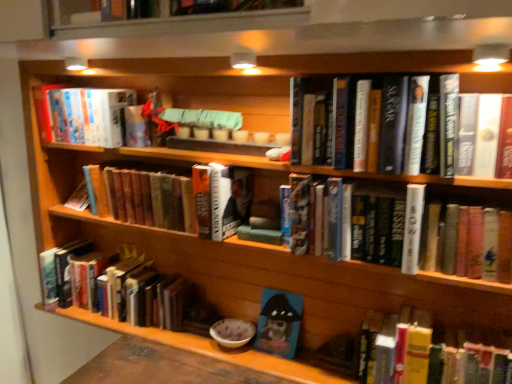
Question: Which direction should I rotate to look at hardcover book at center, positioned as the 3th book in top-to-bottom order, — up or down?

Choices:
 (A) down
 (B) up

Answer: (B)

Question: Is hardcover book at center, positioned as the 3th book in top-to-bottom order, taller than hardcover book at lower left, the 2th book positioned from the bottom?

Choices:
 (A) no
 (B) yes

Answer: (A)

Question: Considering the relative positions of hardcover book at center, positioned as the 3th book in top-to-bottom order, and hardcover book at lower left, the 5th book positioned from the top, in the image provided, is hardcover book at center, positioned as the 3th book in top-to-bottom order, in front of hardcover book at lower left, the 5th book positioned from the top,?

Choices:
 (A) no
 (B) yes

Answer: (B)

Question: Is hardcover book at center, positioned as the 3th book in top-to-bottom order, far away from hardcover book at lower left, the 5th book positioned from the top?

Choices:
 (A) yes
 (B) no

Answer: (B)

Question: From a real-world perspective, is hardcover book at center, positioned as the 3th book in top-to-bottom order, over hardcover book at lower left, the 2th book positioned from the bottom?

Choices:
 (A) no
 (B) yes

Answer: (B)

Question: Does hardcover book at center, positioned as the 3th book in top-to-bottom order, have a lesser height compared to hardcover book at lower left, the 5th book positioned from the top?

Choices:
 (A) yes
 (B) no

Answer: (A)

Question: From a real-world perspective, does hardcover book at center, positioned as the 4th book in bottom-to-top order, sit lower than hardcover book at lower left, the 2th book positioned from the bottom?

Choices:
 (A) yes
 (B) no

Answer: (B)

Question: Considering the relative sizes of hardcover book at center, positioned as the 5th book in bottom-to-top order, and hardcover book at center, positioned as the 3th book in top-to-bottom order, in the image provided, is hardcover book at center, positioned as the 5th book in bottom-to-top order, wider than hardcover book at center, positioned as the 3th book in top-to-bottom order,?

Choices:
 (A) yes
 (B) no

Answer: (B)

Question: Is hardcover book at center, positioned as the 5th book in bottom-to-top order, positioned with its back to hardcover book at center, positioned as the 4th book in bottom-to-top order?

Choices:
 (A) no
 (B) yes

Answer: (A)

Question: Could you tell me if hardcover book at center, positioned as the 5th book in bottom-to-top order, is facing hardcover book at center, positioned as the 3th book in top-to-bottom order?

Choices:
 (A) no
 (B) yes

Answer: (A)

Question: From the image's perspective, is hardcover book at center, positioned as the 5th book in bottom-to-top order, on top of hardcover book at center, positioned as the 3th book in top-to-bottom order?

Choices:
 (A) no
 (B) yes

Answer: (B)

Question: Considering the relative sizes of hardcover book at center, the second book in the top-to-bottom sequence, and hardcover book at center, positioned as the 3th book in top-to-bottom order, in the image provided, is hardcover book at center, the second book in the top-to-bottom sequence, taller than hardcover book at center, positioned as the 3th book in top-to-bottom order,?

Choices:
 (A) no
 (B) yes

Answer: (B)

Question: Does hardcover book at center, positioned as the 5th book in bottom-to-top order, lie in front of hardcover book at center, positioned as the 4th book in bottom-to-top order?

Choices:
 (A) no
 (B) yes

Answer: (B)

Question: Is hardcover book at center, positioned as the 5th book in bottom-to-top order, placed right next to hardcover book at lower left, the 2th book positioned from the bottom?

Choices:
 (A) no
 (B) yes

Answer: (A)